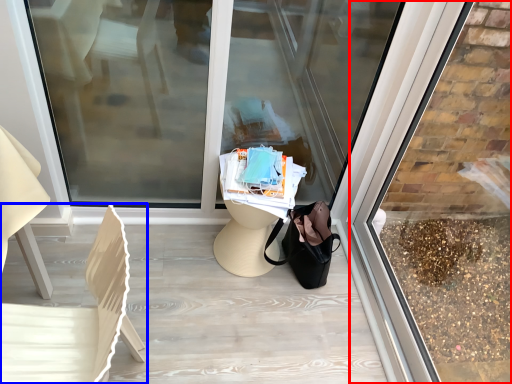
Question: Which of the following is the farthest to the observer, shop window (highlighted by a red box) or chair (highlighted by a blue box)?

Choices:
 (A) shop window
 (B) chair

Answer: (B)